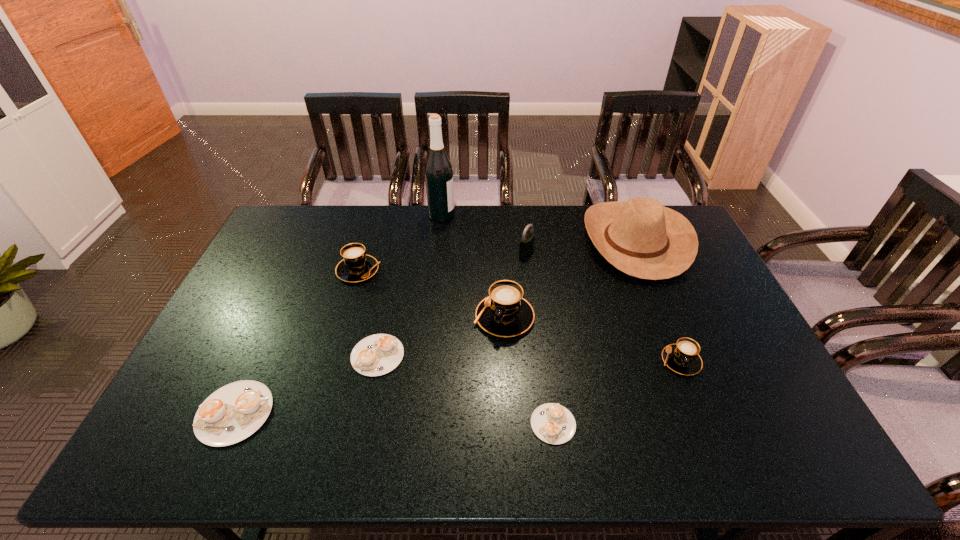
Where is `vacant space that is in between the black padlock and the dark wine bottle`? vacant space that is in between the black padlock and the dark wine bottle is located at coordinates (484, 233).

Image resolution: width=960 pixels, height=540 pixels. I want to click on empty space between the leftmost object and the smallest white cappuccino, so click(x=394, y=418).

This screenshot has width=960, height=540. I want to click on free space between the sixth tallest object and the second tallest object, so click(x=659, y=301).

Where is `vacant area that lies between the fourth object from left to right and the tallest cappuccino`? The width and height of the screenshot is (960, 540). vacant area that lies between the fourth object from left to right and the tallest cappuccino is located at coordinates click(473, 266).

Locate an element on the screen. free spot between the tallest cappuccino and the farthest black cappuccino is located at coordinates (431, 294).

You are a GUI agent. You are given a task and a screenshot of the screen. Output one action in this format:
    pyautogui.click(x=<x>, y=<y>)
    Task: Click on the free spot between the biggest white cappuccino and the black padlock
    The height and width of the screenshot is (540, 960).
    Given the screenshot: What is the action you would take?
    pyautogui.click(x=380, y=332)

Image resolution: width=960 pixels, height=540 pixels. Identify the location of free point between the sixth tallest object and the leftmost object. (458, 387).

Point out which object is positioned as the seventh nearest to the padlock. Please provide its 2D coordinates. Your answer should be formatted as a tuple, i.e. [(x, y)], where the tuple contains the x and y coordinates of a point satisfying the conditions above.

[(553, 423)]

This screenshot has height=540, width=960. In order to click on the eighth closest object to the biggest black cappuccino in this screenshot , I will do `click(232, 413)`.

At what (x,y) coordinates should I click in order to perform the action: click on cappuccino object that ranks as the fifth closest to the padlock. Please return your answer as a coordinate pair (x, y). Image resolution: width=960 pixels, height=540 pixels. Looking at the image, I should click on (553, 423).